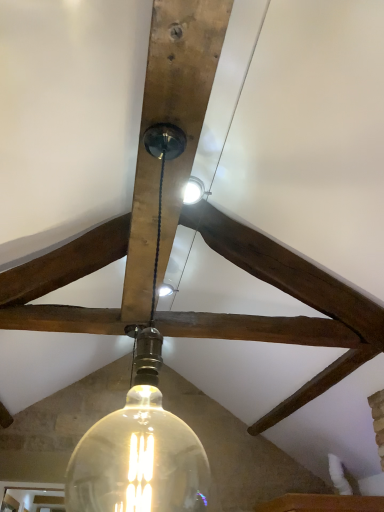
From the picture: What is the approximate height of clear glass bulb at center?

It is 77.82 centimeters.

At what (x,y) coordinates should I click in order to perform the action: click on clear glass bulb at center. Please return your answer as a coordinate pair (x, y). Looking at the image, I should click on (142, 419).

Describe the element at coordinates (142, 419) in the screenshot. I see `clear glass bulb at center` at that location.

Describe the element at coordinates (139, 451) in the screenshot. I see `translucent glass light bulb at center` at that location.

Identify the location of translucent glass light bulb at center. This screenshot has height=512, width=384. (139, 451).

This screenshot has width=384, height=512. What are the coordinates of `clear glass bulb at center` in the screenshot? It's located at (142, 419).

Visually, is clear glass bulb at center positioned to the left or to the right of translucent glass light bulb at center?

Clearly, clear glass bulb at center is on the right of translucent glass light bulb at center in the image.

Does clear glass bulb at center lie in front of translucent glass light bulb at center?

Yes, clear glass bulb at center is in front of translucent glass light bulb at center.

Looking at this image, which is nearer, (177, 484) or (151, 385)?

Point (177, 484) is farther from the camera than point (151, 385).

From the image's perspective, which is below, clear glass bulb at center or translucent glass light bulb at center?

From the image's view, translucent glass light bulb at center is below.

From a real-world perspective, relative to translucent glass light bulb at center, is clear glass bulb at center vertically above or below?

From a real-world perspective, clear glass bulb at center is physically below translucent glass light bulb at center.

Looking at their sizes, would you say clear glass bulb at center is wider or thinner than translucent glass light bulb at center?

Clearly, clear glass bulb at center has more width compared to translucent glass light bulb at center.

Between clear glass bulb at center and translucent glass light bulb at center, which one has less height?

Standing shorter between the two is translucent glass light bulb at center.

Does clear glass bulb at center have a smaller size compared to translucent glass light bulb at center?

Yes.

Based on the photo, can we say clear glass bulb at center lies outside translucent glass light bulb at center?

Yes.

Is clear glass bulb at center next to translucent glass light bulb at center?

Yes, clear glass bulb at center is beside translucent glass light bulb at center.

Could you tell me if clear glass bulb at center is facing translucent glass light bulb at center?

Yes, clear glass bulb at center is facing translucent glass light bulb at center.

You are a GUI agent. You are given a task and a screenshot of the screen. Output one action in this format:
    pyautogui.click(x=<x>, y=<y>)
    Task: Click on the light bulb that appears below the clear glass bulb at center (from the image's perspective)
    
    Given the screenshot: What is the action you would take?
    pyautogui.click(x=139, y=451)

Which object is positioned more to the left, translucent glass light bulb at center or clear glass bulb at center?

Positioned to the left is translucent glass light bulb at center.

Is translucent glass light bulb at center in front of or behind clear glass bulb at center in the image?

translucent glass light bulb at center is positioned farther from the viewer than clear glass bulb at center.

Does point (86, 459) come behind point (157, 500)?

Yes.

From the image's perspective, which is below, translucent glass light bulb at center or clear glass bulb at center?

translucent glass light bulb at center is shown below in the image.

From a real-world perspective, is translucent glass light bulb at center physically located above or below clear glass bulb at center?

From a real-world perspective, translucent glass light bulb at center is physically above clear glass bulb at center.

Considering the sizes of translucent glass light bulb at center and clear glass bulb at center in the image, is translucent glass light bulb at center wider or thinner than clear glass bulb at center?

Considering their sizes, translucent glass light bulb at center looks slimmer than clear glass bulb at center.

Who is taller, translucent glass light bulb at center or clear glass bulb at center?

clear glass bulb at center.

Between translucent glass light bulb at center and clear glass bulb at center, which one has smaller size?

Smaller between the two is clear glass bulb at center.

Is clear glass bulb at center located within translucent glass light bulb at center?

That's incorrect, clear glass bulb at center is not inside translucent glass light bulb at center.

Would you say translucent glass light bulb at center is a long distance from clear glass bulb at center?

translucent glass light bulb at center is near clear glass bulb at center, not far away.

Is translucent glass light bulb at center positioned with its back to clear glass bulb at center?

That's right, translucent glass light bulb at center is facing away from clear glass bulb at center.

How distant is translucent glass light bulb at center from clear glass bulb at center?

The distance of translucent glass light bulb at center from clear glass bulb at center is 0.92 inches.

This screenshot has height=512, width=384. I want to click on lamp located on the right of translucent glass light bulb at center, so click(x=142, y=419).

Find the location of a particular element. light bulb that appears behind the clear glass bulb at center is located at coordinates (139, 451).

The image size is (384, 512). In order to click on lamp on the right of the translucent glass light bulb at center in this screenshot , I will do `click(142, 419)`.